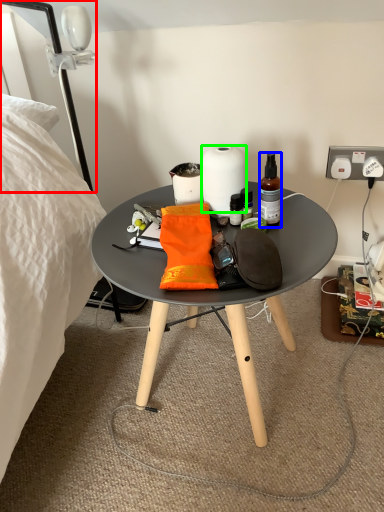
Question: Estimate the real-world distances between objects in this image. Which object is closer to lamp (highlighted by a red box), bottle (highlighted by a blue box) or paper towel (highlighted by a green box)?

Choices:
 (A) bottle
 (B) paper towel

Answer: (B)